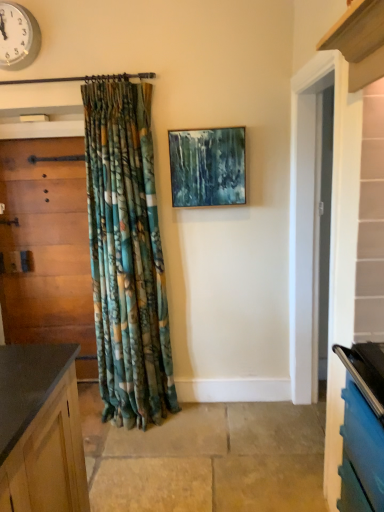
Question: Can you confirm if wooden door at left is bigger than metallic clock at upper left?

Choices:
 (A) no
 (B) yes

Answer: (B)

Question: Is wooden door at left thinner than metallic clock at upper left?

Choices:
 (A) yes
 (B) no

Answer: (B)

Question: From a real-world perspective, is wooden door at left located beneath metallic clock at upper left?

Choices:
 (A) yes
 (B) no

Answer: (A)

Question: Is the position of wooden door at left more distant than that of metallic clock at upper left?

Choices:
 (A) no
 (B) yes

Answer: (B)

Question: Can you confirm if wooden door at left is shorter than metallic clock at upper left?

Choices:
 (A) no
 (B) yes

Answer: (A)

Question: In terms of height, does metallic clock at upper left look taller or shorter compared to wooden door at left?

Choices:
 (A) tall
 (B) short

Answer: (B)

Question: Is metallic clock at upper left situated inside wooden door at left or outside?

Choices:
 (A) inside
 (B) outside

Answer: (B)

Question: From a real-world perspective, relative to wooden door at left, is metallic clock at upper left vertically above or below?

Choices:
 (A) below
 (B) above

Answer: (B)

Question: In the image, is metallic clock at upper left on the left side or the right side of wooden door at left?

Choices:
 (A) right
 (B) left

Answer: (A)

Question: From the image's perspective, is metallic clock at upper left above or below teal acrylic painting at center?

Choices:
 (A) above
 (B) below

Answer: (A)

Question: Considering the positions of metallic clock at upper left and teal acrylic painting at center in the image, is metallic clock at upper left taller or shorter than teal acrylic painting at center?

Choices:
 (A) short
 (B) tall

Answer: (A)

Question: Is metallic clock at upper left spatially inside teal acrylic painting at center, or outside of it?

Choices:
 (A) outside
 (B) inside

Answer: (A)

Question: Is metallic clock at upper left bigger or smaller than teal acrylic painting at center?

Choices:
 (A) big
 (B) small

Answer: (B)

Question: Considering the positions of teal acrylic painting at center and wooden door at left in the image, is teal acrylic painting at center bigger or smaller than wooden door at left?

Choices:
 (A) big
 (B) small

Answer: (B)

Question: From the image's perspective, relative to wooden door at left, is teal acrylic painting at center above or below?

Choices:
 (A) above
 (B) below

Answer: (A)